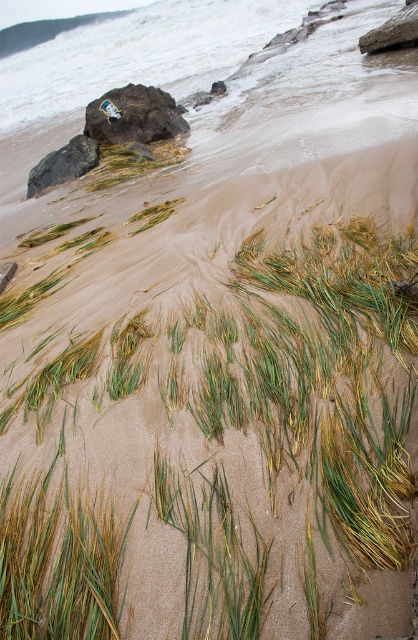
You are standing on the beach and want to reach the dark gray rock at left without getting your shoes wet. The rusty metallic rock at upper left is in your path. Which rock should you step on first to stay dry?

You should step on the rusty metallic rock at upper left first because it is closer to you than the dark gray rock at left. Since it is further away, the dark gray rock at left might be in deeper water, so stepping on the closer rusty metallic rock first would help you avoid getting wet.

You are standing on the beach and see the rusty metallic rock at upper left and the dark gray rock at left. Which rock is closer to your right side?

The rusty metallic rock at upper left is positioned on the right side of dark gray rock at left, so it is closer to your right side.

You are a geologist examining the beach. You need to determine which rock is bigger between the rusty metallic rock at upper left and the dark gray rock at left. Which one is bigger?

The rusty metallic rock at upper left is larger in size compared to the dark gray rock at left.